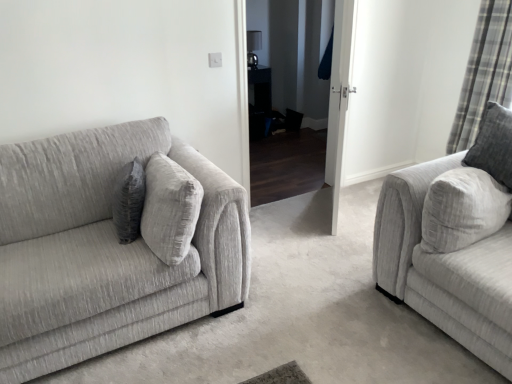
This screenshot has height=384, width=512. Describe the element at coordinates (484, 72) in the screenshot. I see `plaid fabric curtain at right` at that location.

The width and height of the screenshot is (512, 384). What do you see at coordinates (111, 246) in the screenshot?
I see `textured gray couch at left, placed as the second studio couch when sorted from right to left` at bounding box center [111, 246].

This screenshot has height=384, width=512. Identify the location of plaid fabric curtain at right. (484, 72).

Is textured gray couch at left, arranged as the 1th studio couch when viewed from the left, not near gray fabric pillow at center?

textured gray couch at left, arranged as the 1th studio couch when viewed from the left, is actually quite close to gray fabric pillow at center.

What's the angular difference between textured gray couch at left, placed as the second studio couch when sorted from right to left, and gray fabric pillow at center's facing directions?

They differ by 104 degrees in their facing directions.

Where is `pillow located on the right of textured gray couch at left, placed as the second studio couch when sorted from right to left`? pillow located on the right of textured gray couch at left, placed as the second studio couch when sorted from right to left is located at coordinates (129, 201).

Which object is thinner, textured gray couch at left, placed as the second studio couch when sorted from right to left, or gray fabric pillow at center?

gray fabric pillow at center.

Considering the relative sizes of gray fabric pillow at center and textured gray couch at left, arranged as the 1th studio couch when viewed from the left, in the image provided, is gray fabric pillow at center bigger than textured gray couch at left, arranged as the 1th studio couch when viewed from the left,?

No.

From the picture: Does gray fabric pillow at center turn towards textured gray couch at left, placed as the second studio couch when sorted from right to left?

Yes.

Does point (140, 171) appear closer or farther from the camera than point (136, 130)?

Point (140, 171) is closer to the camera than point (136, 130).

From the image's perspective, which is below, gray fabric pillow at center or textured gray couch at left, placed as the second studio couch when sorted from right to left?

textured gray couch at left, placed as the second studio couch when sorted from right to left, is shown below in the image.

Is there a large distance between white glossy door at center and textured gray couch at right, positioned as the 2th studio couch in left-to-right order?

white glossy door at center is near textured gray couch at right, positioned as the 2th studio couch in left-to-right order, not far away.

Between white glossy door at center and textured gray couch at right, which is the 1th studio couch in right-to-left order, which one appears on the left side from the viewer's perspective?

Positioned to the left is white glossy door at center.

Looking at this image, is white glossy door at center inside the boundaries of textured gray couch at right, positioned as the 2th studio couch in left-to-right order, or outside?

white glossy door at center is not enclosed by textured gray couch at right, positioned as the 2th studio couch in left-to-right order.

From a real-world perspective, which is physically below, white glossy door at center or textured gray couch at right, which is the 1th studio couch in right-to-left order?

From a 3D spatial view, textured gray couch at right, which is the 1th studio couch in right-to-left order, is below.

Is textured gray couch at left, arranged as the 1th studio couch when viewed from the left, facing towards white glossy door at center?

No, textured gray couch at left, arranged as the 1th studio couch when viewed from the left, is not oriented towards white glossy door at center.

Between textured gray couch at left, arranged as the 1th studio couch when viewed from the left, and white glossy door at center, which one is positioned behind?

white glossy door at center is further away from the camera.

Considering the relative sizes of textured gray couch at left, arranged as the 1th studio couch when viewed from the left, and white glossy door at center in the image provided, is textured gray couch at left, arranged as the 1th studio couch when viewed from the left, thinner than white glossy door at center?

No.

You are a GUI agent. You are given a task and a screenshot of the screen. Output one action in this format:
    pyautogui.click(x=<x>, y=<y>)
    Task: Click on the glass door that is above the textured gray couch at left, placed as the second studio couch when sorted from right to left (from the image's perspective)
    The image size is (512, 384).
    Given the screenshot: What is the action you would take?
    pyautogui.click(x=339, y=99)

Are plaid fabric curtain at right and textured gray couch at right, positioned as the 2th studio couch in left-to-right order, located far from each other?

plaid fabric curtain at right is positioned a significant distance from textured gray couch at right, positioned as the 2th studio couch in left-to-right order.

Is plaid fabric curtain at right oriented towards textured gray couch at right, positioned as the 2th studio couch in left-to-right order?

No, plaid fabric curtain at right is not turned towards textured gray couch at right, positioned as the 2th studio couch in left-to-right order.

Who is bigger, plaid fabric curtain at right or textured gray couch at right, which is the 1th studio couch in right-to-left order?

textured gray couch at right, which is the 1th studio couch in right-to-left order.

What's the angular difference between plaid fabric curtain at right and textured gray couch at right, positioned as the 2th studio couch in left-to-right order,'s facing directions?

plaid fabric curtain at right and textured gray couch at right, positioned as the 2th studio couch in left-to-right order, are facing 4.1 degrees away from each other.

From a real-world perspective, is plaid fabric curtain at right on top of gray fabric pillow at center?

Indeed, from a real-world perspective, plaid fabric curtain at right stands above gray fabric pillow at center.

Locate an element on the screen. curtain lying above the gray fabric pillow at center (from the image's perspective) is located at coordinates (484, 72).

Is point (492, 83) closer or farther from the camera than point (145, 176)?

Clearly, point (492, 83) is more distant from the camera than point (145, 176).

This screenshot has width=512, height=384. In order to click on the 2nd studio couch positioned below the gray fabric pillow at center (from the image's perspective) in this screenshot , I will do `click(455, 241)`.

Is textured gray couch at right, which is the 1th studio couch in right-to-left order, wider than gray fabric pillow at center?

Indeed, textured gray couch at right, which is the 1th studio couch in right-to-left order, has a greater width compared to gray fabric pillow at center.

Which is behind, textured gray couch at right, which is the 1th studio couch in right-to-left order, or gray fabric pillow at center?

gray fabric pillow at center is further from the camera.

Find the location of `the 1st studio couch below the gray fabric pillow at center (from a real-world perspective)`. the 1st studio couch below the gray fabric pillow at center (from a real-world perspective) is located at coordinates (111, 246).

From the image's perspective, which studio couch is the 1st one below the gray fabric pillow at center? Please provide its 2D coordinates.

[(111, 246)]

Looking at the image, which one is located closer to gray fabric pillow at center, textured gray couch at right, positioned as the 2th studio couch in left-to-right order, or plaid fabric curtain at right?

textured gray couch at right, positioned as the 2th studio couch in left-to-right order, lies closer to gray fabric pillow at center than the other object.

Looking at the image, which one is located further to textured gray couch at left, arranged as the 1th studio couch when viewed from the left, textured gray couch at right, which is the 1th studio couch in right-to-left order, or black glossy table at center?

The object further to textured gray couch at left, arranged as the 1th studio couch when viewed from the left, is black glossy table at center.

Looking at the image, which one is located further to textured gray couch at right, positioned as the 2th studio couch in left-to-right order, textured gray couch at left, placed as the second studio couch when sorted from right to left, or gray fabric pillow at center?

The object further to textured gray couch at right, positioned as the 2th studio couch in left-to-right order, is gray fabric pillow at center.

Which object lies further to the anchor point textured gray couch at right, positioned as the 2th studio couch in left-to-right order, black glossy table at center or textured gray couch at left, placed as the second studio couch when sorted from right to left?

black glossy table at center is positioned further to the anchor textured gray couch at right, positioned as the 2th studio couch in left-to-right order.

When comparing their distances from textured gray couch at right, positioned as the 2th studio couch in left-to-right order, does white glossy door at center or black glossy table at center seem further?

black glossy table at center is positioned further to the anchor textured gray couch at right, positioned as the 2th studio couch in left-to-right order.

When comparing their distances from black glossy table at center, does white glossy door at center or textured gray couch at left, arranged as the 1th studio couch when viewed from the left, seem further?

The object further to black glossy table at center is textured gray couch at left, arranged as the 1th studio couch when viewed from the left.

Looking at the image, which one is located further to white glossy door at center, gray fabric pillow at center or textured gray couch at left, arranged as the 1th studio couch when viewed from the left?

textured gray couch at left, arranged as the 1th studio couch when viewed from the left, is further to white glossy door at center.

When comparing their distances from gray fabric pillow at center, does textured gray couch at left, placed as the second studio couch when sorted from right to left, or white glossy door at center seem closer?

textured gray couch at left, placed as the second studio couch when sorted from right to left.

Find the location of a particular element. This screenshot has height=384, width=512. curtain positioned between textured gray couch at right, which is the 1th studio couch in right-to-left order, and black glossy table at center from near to far is located at coordinates (484, 72).

The height and width of the screenshot is (384, 512). In order to click on pillow between textured gray couch at left, placed as the second studio couch when sorted from right to left, and white glossy door at center in this screenshot , I will do `click(129, 201)`.

Locate an element on the screen. This screenshot has width=512, height=384. curtain positioned between gray fabric pillow at center and black glossy table at center from near to far is located at coordinates (484, 72).

I want to click on pillow between textured gray couch at left, arranged as the 1th studio couch when viewed from the left, and plaid fabric curtain at right from left to right, so click(x=129, y=201).